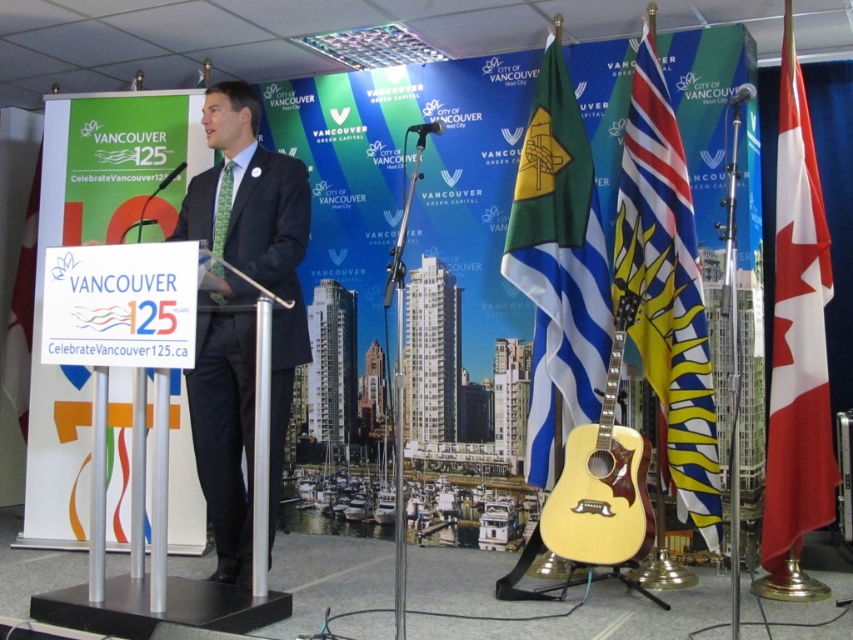
Can you confirm if black matte suit at center is positioned below white paper at left?

Yes, black matte suit at center is below white paper at left.

Where is `black matte suit at center`? black matte suit at center is located at coordinates pos(274,278).

Between point (222, 336) and point (10, 304), which one is positioned in front?

Positioned in front is point (222, 336).

The width and height of the screenshot is (853, 640). What are the coordinates of `black matte suit at center` in the screenshot? It's located at (274, 278).

In the scene shown: Can you confirm if green fabric flag at center is wider than yellow and black striped flag at center?

Yes, green fabric flag at center is wider than yellow and black striped flag at center.

The image size is (853, 640). Describe the element at coordinates (558, 268) in the screenshot. I see `green fabric flag at center` at that location.

I want to click on green fabric flag at center, so click(x=558, y=268).

Is point (283, 260) farther from camera compared to point (776, 518)?

That is False.

Is black matte suit at center wider than red/white fabric flag at right?

Yes.

Measure the distance between point (228, 548) and camera.

Point (228, 548) and camera are 3.96 meters apart.

Where is `black matte suit at center`? black matte suit at center is located at coordinates (274, 278).